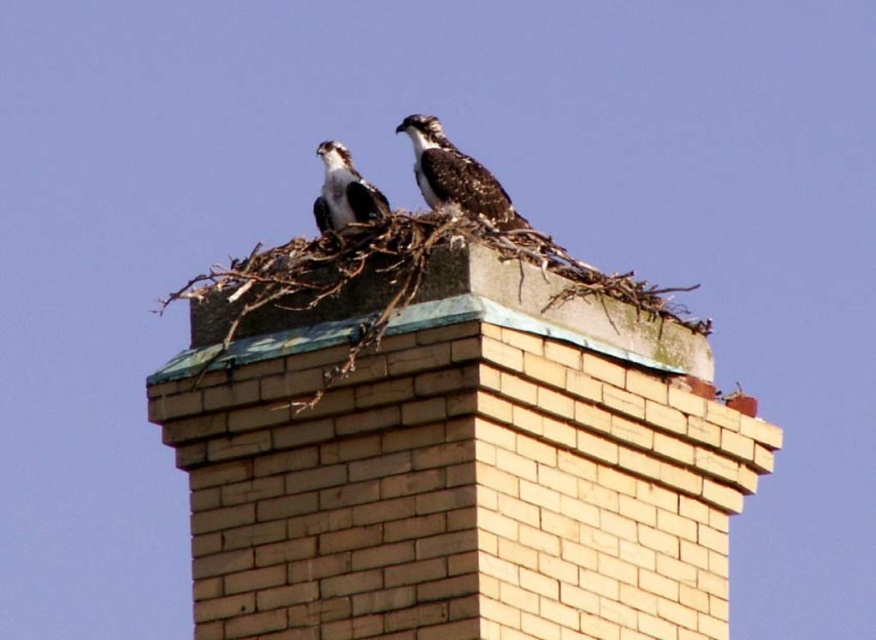
You are a birdwatcher observing the beige brick chimney at center and the brown speckled feathers at center. Which object is wider?

The beige brick chimney at center is wider than the brown speckled feathers at center.

You are an ornithologist observing the beige brick chimney at center and the dark brown speckled feathers at center. Which object is closer to you?

The beige brick chimney at center is closer to you because it is positioned in front of the dark brown speckled feathers at center.

You are a birdwatcher observing the two osprey birds on the nest. You notice some dark brown speckled feathers at center. Where exactly are these feathers located in the image?

The dark brown speckled feathers at center are located at coordinates point (456, 176).